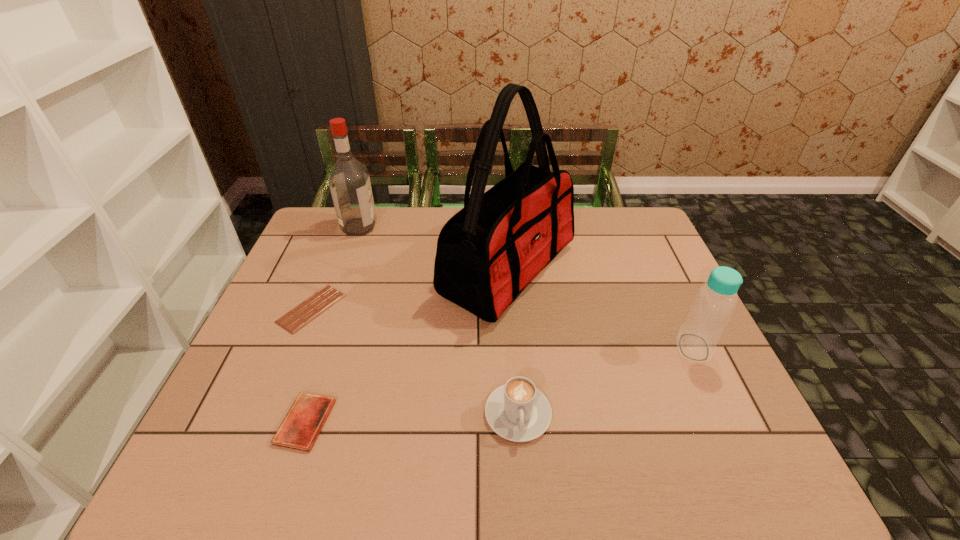
Locate an element on the screen. The height and width of the screenshot is (540, 960). free spot located 0.080m to the right of the fourth tallest object is located at coordinates [523, 484].

Find the location of `vacant space located on the left of the fifth tallest object`. vacant space located on the left of the fifth tallest object is located at coordinates (234, 422).

Where is `vacant region located on the right of the shortest object`? This screenshot has width=960, height=540. vacant region located on the right of the shortest object is located at coordinates (x=397, y=308).

The height and width of the screenshot is (540, 960). I want to click on duffel bag located at the far edge, so click(487, 253).

At what (x,y) coordinates should I click in order to perform the action: click on liquor that is at the far edge. Please return your answer as a coordinate pair (x, y). The image size is (960, 540). Looking at the image, I should click on (349, 181).

Where is `cappuccino located in the near edge section of the desktop`? cappuccino located in the near edge section of the desktop is located at coordinates (517, 411).

At what (x,y) coordinates should I click in order to perform the action: click on diary positioned at the near edge. Please return your answer as a coordinate pair (x, y). Looking at the image, I should click on (300, 428).

This screenshot has height=540, width=960. In order to click on liquor that is at the left edge in this screenshot , I will do click(x=349, y=181).

Identify the location of diary present at the left edge. (300, 428).

The width and height of the screenshot is (960, 540). I want to click on chocolate bar present at the left edge, so click(x=308, y=310).